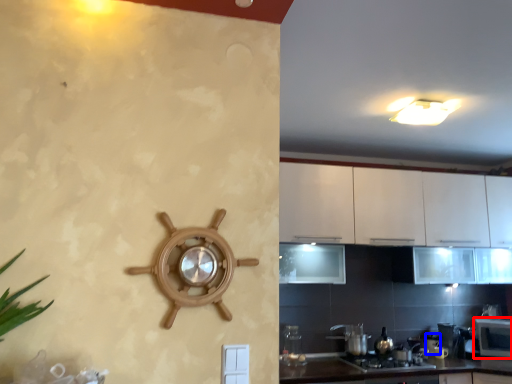
Question: Among these objects, which one is nearest to the camera, microwave (highlighted by a red box) or appliance (highlighted by a blue box)?

Choices:
 (A) microwave
 (B) appliance

Answer: (A)